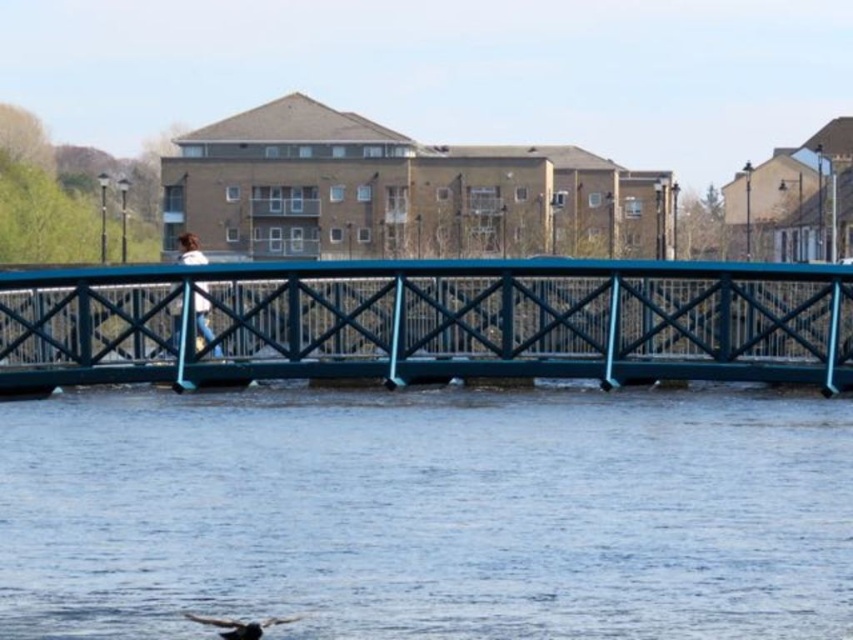
Question: Considering the real-world distances, which object is farthest from the blue water at center?

Choices:
 (A) metallic blue pedestrian bridge at center
 (B) white matte jacket at center

Answer: (B)

Question: Which point is closer to the camera taking this photo?

Choices:
 (A) (770, 339)
 (B) (213, 346)

Answer: (A)

Question: Which object is the closest to the metallic blue pedestrian bridge at center?

Choices:
 (A) blue water at center
 (B) white matte jacket at center

Answer: (A)

Question: Does blue water at center appear on the left side of white matte jacket at center?

Choices:
 (A) yes
 (B) no

Answer: (B)

Question: Can you confirm if metallic blue pedestrian bridge at center is positioned above white matte jacket at center?

Choices:
 (A) yes
 (B) no

Answer: (B)

Question: Can you confirm if blue water at center is smaller than metallic blue pedestrian bridge at center?

Choices:
 (A) yes
 (B) no

Answer: (B)